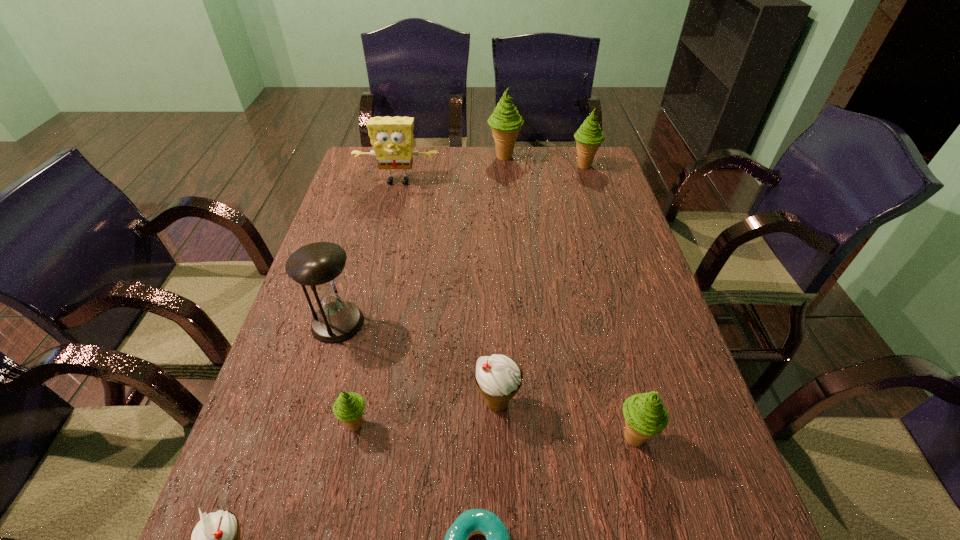
Image resolution: width=960 pixels, height=540 pixels. What are the coordinates of `the biggest green icecream` in the screenshot? It's located at (505, 122).

What are the coordinates of `the tallest icecream` in the screenshot? It's located at (505, 122).

Locate an element on the screen. yellow sponge is located at coordinates (391, 137).

I want to click on the fifth shortest icecream, so click(589, 136).

At what (x,y) coordinates should I click in order to perform the action: click on the fourth farthest object. Please return your answer as a coordinate pair (x, y). Looking at the image, I should click on (318, 265).

At what (x,y) coordinates should I click in order to perform the action: click on the farther white icecream. Please return your answer as a coordinate pair (x, y). The image size is (960, 540). Looking at the image, I should click on (498, 378).

I want to click on the bigger white icecream, so click(x=498, y=378).

Locate an element on the screen. This screenshot has width=960, height=540. the second smallest green icecream is located at coordinates (645, 415).

You are a GUI agent. You are given a task and a screenshot of the screen. Output one action in this format:
    pyautogui.click(x=<x>, y=<y>)
    Task: Click on the fifth icecream from right to left
    This screenshot has height=540, width=960.
    Given the screenshot: What is the action you would take?
    pyautogui.click(x=348, y=408)

At what (x,y) coordinates should I click in order to perform the action: click on the smallest green icecream. Please return your answer as a coordinate pair (x, y). Image resolution: width=960 pixels, height=540 pixels. Looking at the image, I should click on (348, 408).